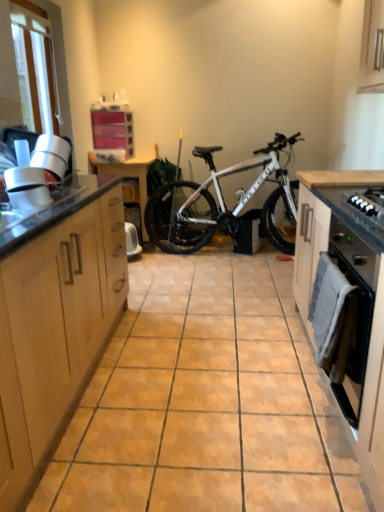
Question: Is black matte oven door at right, which ranks as the second cabinetry in left-to-right order, closer to camera compared to black matte oven at right?

Choices:
 (A) no
 (B) yes

Answer: (B)

Question: Could you tell me if black matte oven door at right, marked as the 1th cabinetry in a right-to-left arrangement, is turned towards black matte oven at right?

Choices:
 (A) no
 (B) yes

Answer: (B)

Question: From a real-world perspective, is black matte oven door at right, which ranks as the second cabinetry in left-to-right order, positioned over black matte oven at right based on gravity?

Choices:
 (A) no
 (B) yes

Answer: (A)

Question: Is black matte oven at right at the back of black matte oven door at right, marked as the 1th cabinetry in a right-to-left arrangement?

Choices:
 (A) no
 (B) yes

Answer: (B)

Question: From the image's perspective, is black matte oven door at right, marked as the 1th cabinetry in a right-to-left arrangement, above black matte oven at right?

Choices:
 (A) yes
 (B) no

Answer: (B)

Question: In terms of height, does white glossy vent at left look taller or shorter compared to transparent glass window at upper left?

Choices:
 (A) tall
 (B) short

Answer: (B)

Question: Considering the positions of white glossy vent at left and transparent glass window at upper left in the image, is white glossy vent at left bigger or smaller than transparent glass window at upper left?

Choices:
 (A) big
 (B) small

Answer: (B)

Question: Choose the correct answer: Is white glossy vent at left inside transparent glass window at upper left or outside it?

Choices:
 (A) outside
 (B) inside

Answer: (A)

Question: In the image, is white glossy vent at left positioned in front of or behind transparent glass window at upper left?

Choices:
 (A) front
 (B) behind

Answer: (A)

Question: Is black matte gas stove at right in front of or behind light wood cabinet at left, the 1th cabinetry positioned from the left, in the image?

Choices:
 (A) behind
 (B) front

Answer: (A)

Question: In terms of width, does black matte gas stove at right look wider or thinner when compared to light wood cabinet at left, positioned as the second cabinetry in right-to-left order?

Choices:
 (A) wide
 (B) thin

Answer: (B)

Question: Considering the positions of point (380, 194) and point (49, 370), is point (380, 194) closer or farther from the camera than point (49, 370)?

Choices:
 (A) closer
 (B) farther

Answer: (B)

Question: From a real-world perspective, relative to light wood cabinet at left, positioned as the second cabinetry in right-to-left order, is black matte gas stove at right vertically above or below?

Choices:
 (A) above
 (B) below

Answer: (A)

Question: In terms of width, does orange matte tile at center look wider or thinner when compared to black matte oven door at right, which ranks as the second cabinetry in left-to-right order?

Choices:
 (A) thin
 (B) wide

Answer: (B)

Question: Would you say orange matte tile at center is inside or outside black matte oven door at right, which ranks as the second cabinetry in left-to-right order?

Choices:
 (A) inside
 (B) outside

Answer: (B)